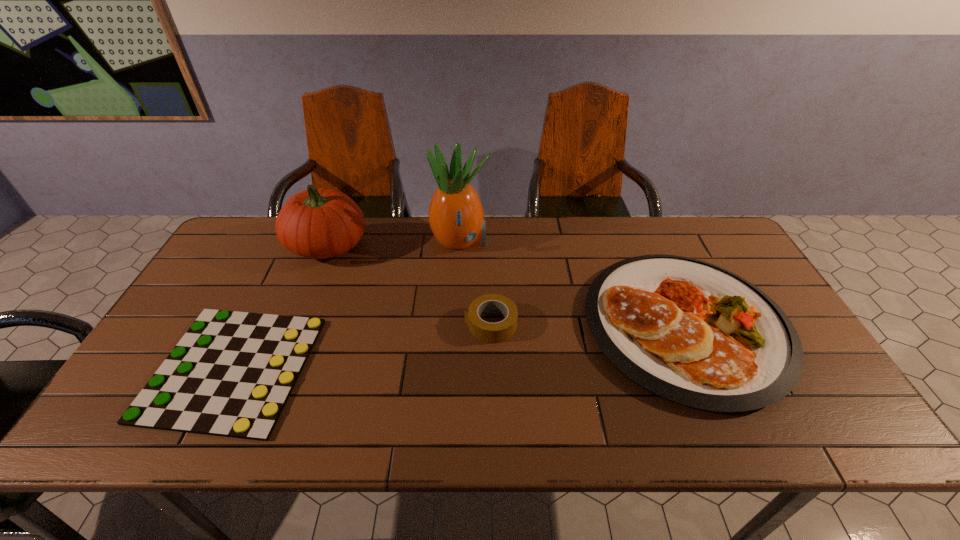
At what (x,y) coordinates should I click in order to perform the action: click on object that is at the near left corner. Please return your answer as a coordinate pair (x, y). The width and height of the screenshot is (960, 540). Looking at the image, I should click on (231, 374).

At what (x,y) coordinates should I click in order to perform the action: click on object that is positioned at the far right corner. Please return your answer as a coordinate pair (x, y). Looking at the image, I should click on (693, 333).

Locate an element on the screen. Image resolution: width=960 pixels, height=540 pixels. object located in the near right corner section of the desktop is located at coordinates (693, 333).

This screenshot has height=540, width=960. In the image, there is a desktop. What are the coordinates of `vacant region at the far edge` in the screenshot? It's located at (657, 252).

I want to click on vacant space at the near edge of the desktop, so click(x=365, y=413).

Image resolution: width=960 pixels, height=540 pixels. In the image, there is a desktop. In order to click on blank space at the left edge in this screenshot , I will do `click(227, 302)`.

Find the location of a particular element. free region at the right edge of the desktop is located at coordinates click(741, 268).

This screenshot has height=540, width=960. In the image, there is a desktop. What are the coordinates of `vacant space at the far right corner` in the screenshot? It's located at (730, 244).

The image size is (960, 540). Find the location of `free space that is in between the pumpkin and the pineapple`. free space that is in between the pumpkin and the pineapple is located at coordinates (394, 244).

This screenshot has width=960, height=540. Find the location of `unoccupied position between the shortest object and the pumpkin`. unoccupied position between the shortest object and the pumpkin is located at coordinates 280,307.